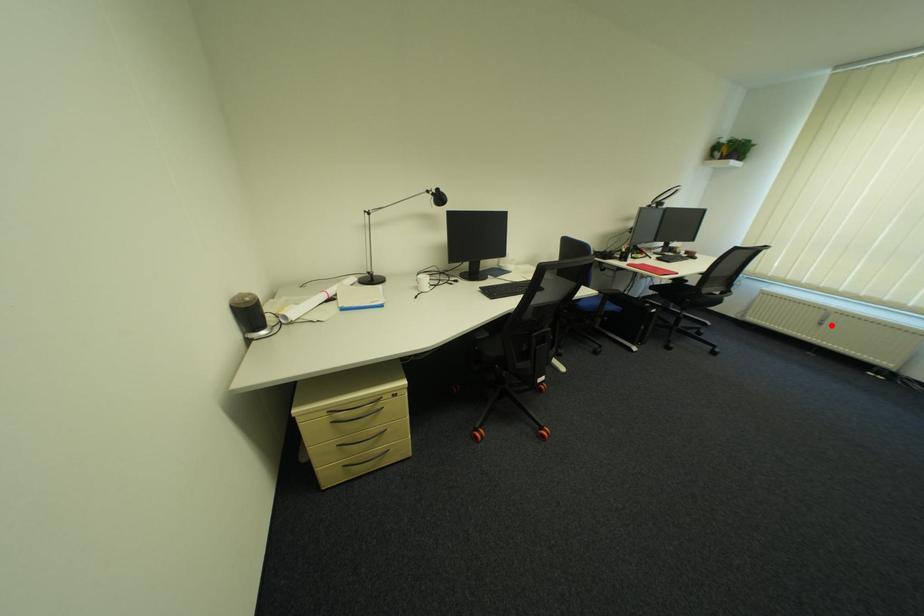
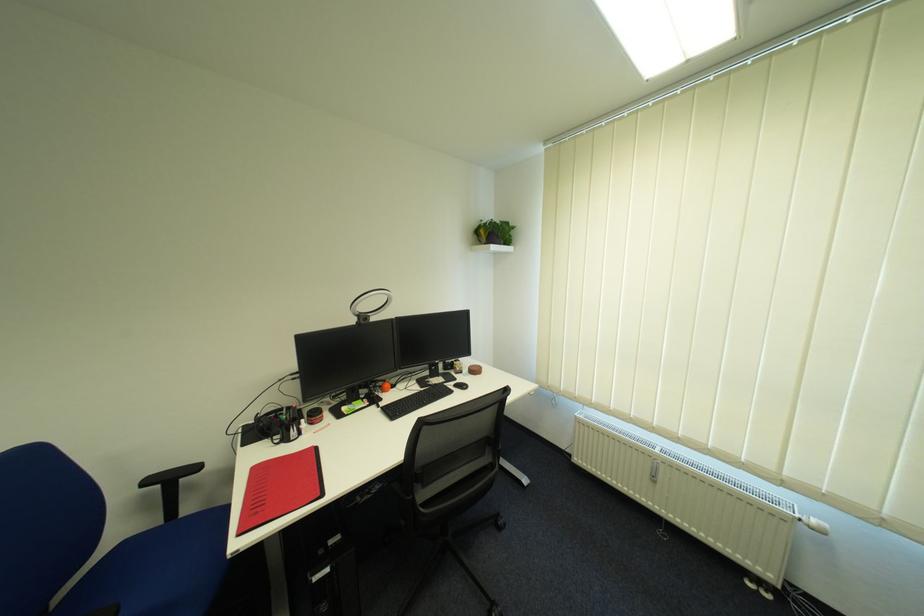
In the second image, find the point that corresponds to the highlighted location in the first image.

(664, 483)